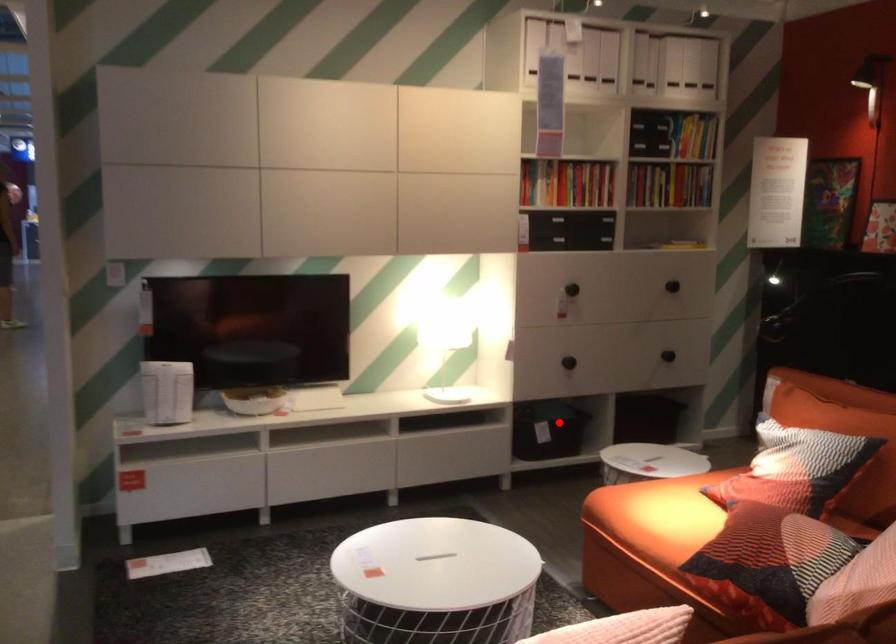
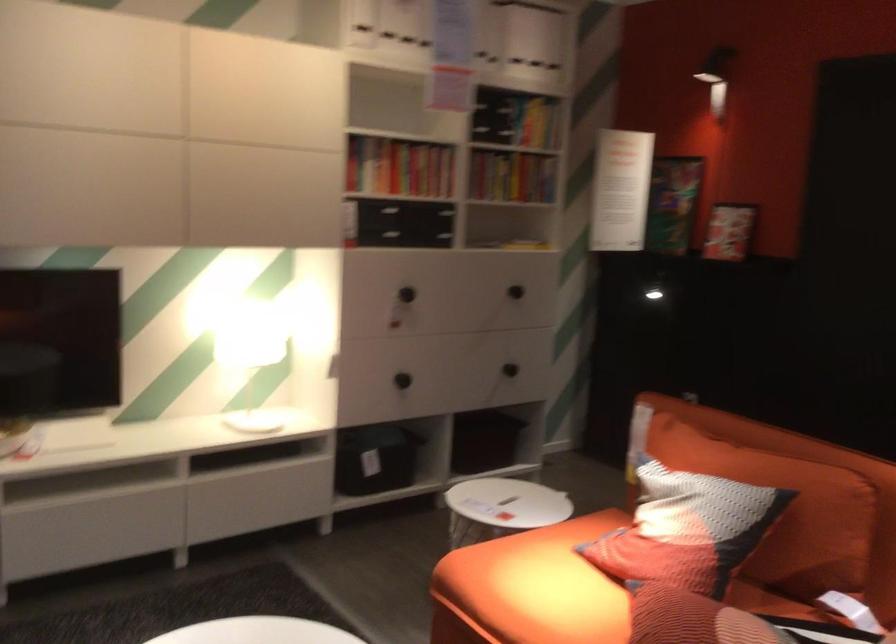
Question: I am providing you with two images of the same scene from different viewpoints. Image1 has a red point marked. In image2, the corresponding 3D location appears at what relative position? Reply with the corresponding letter.

Choices:
 (A) Closer
 (B) Farther

Answer: (A)